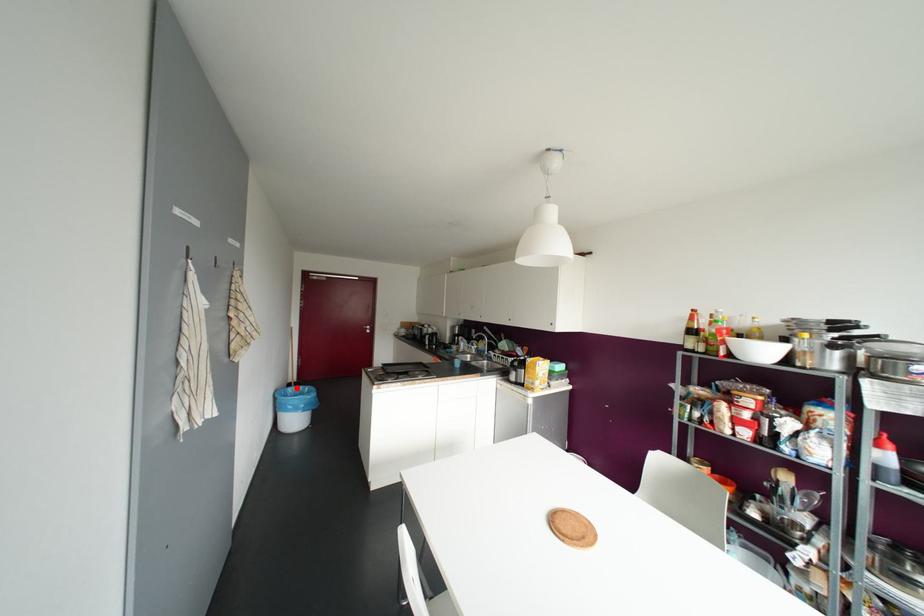
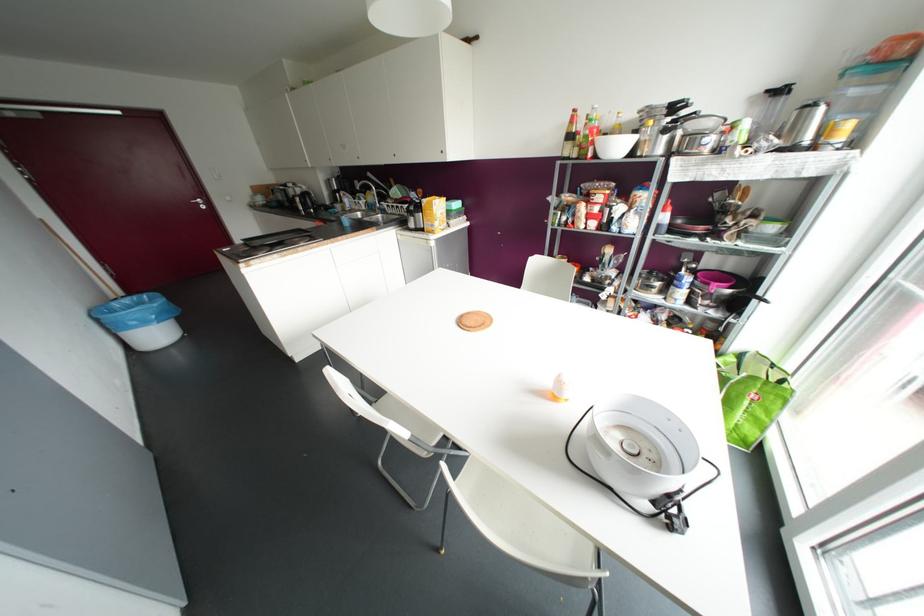
The point at the highlighted location is marked in the first image. Where is the corresponding point in the second image?

(127, 300)